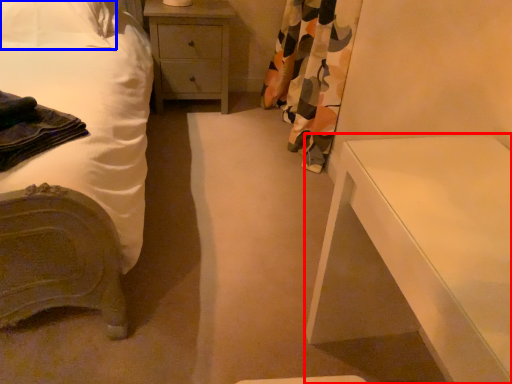
Question: Which of the following is the closest to the observer, nightstand (highlighted by a red box) or pillow (highlighted by a blue box)?

Choices:
 (A) nightstand
 (B) pillow

Answer: (A)